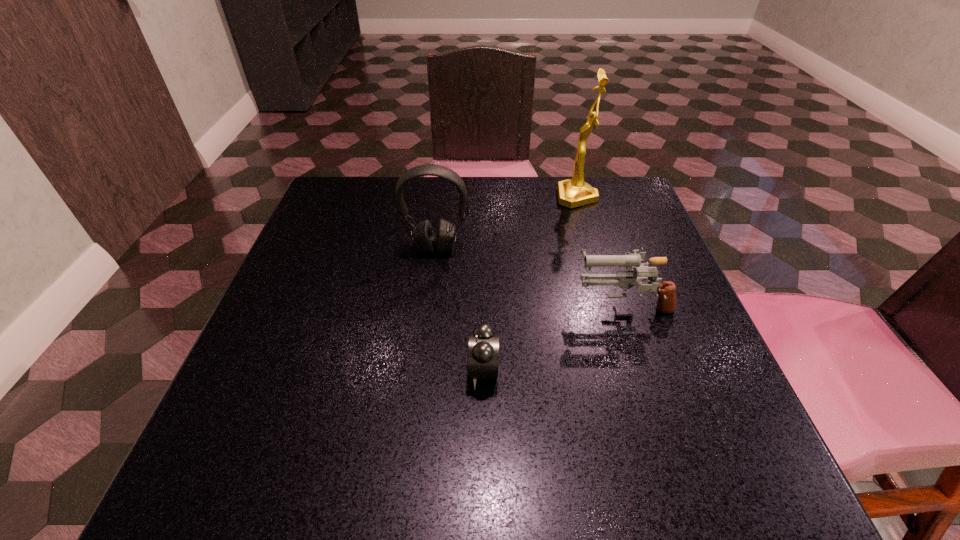
I want to click on free space located 0.060m on the front-facing side of the farthest object, so click(x=534, y=197).

Identify the location of vacant space positioned 0.160m on the front-facing side of the leftmost object. The width and height of the screenshot is (960, 540). (429, 310).

Image resolution: width=960 pixels, height=540 pixels. I want to click on free space located at the barrel end of the second nearest object, so click(x=548, y=303).

What are the coordinates of `vacant area situated 0.120m at the barrel end of the second nearest object` in the screenshot? It's located at (513, 303).

This screenshot has height=540, width=960. Identify the location of vacant point located 0.100m at the barrel end of the second nearest object. (523, 303).

The image size is (960, 540). I want to click on blank area located 0.290m on the front side of the third object from right to left, so click(x=298, y=370).

This screenshot has width=960, height=540. Find the location of `free point located on the front side of the third object from right to left`. free point located on the front side of the third object from right to left is located at coordinates (392, 370).

This screenshot has width=960, height=540. I want to click on free space located on the front side of the third object from right to left, so click(245, 370).

Locate an element on the screen. Image resolution: width=960 pixels, height=540 pixels. object positioned at the far edge is located at coordinates (572, 193).

The width and height of the screenshot is (960, 540). I want to click on award located at the right edge, so click(x=572, y=193).